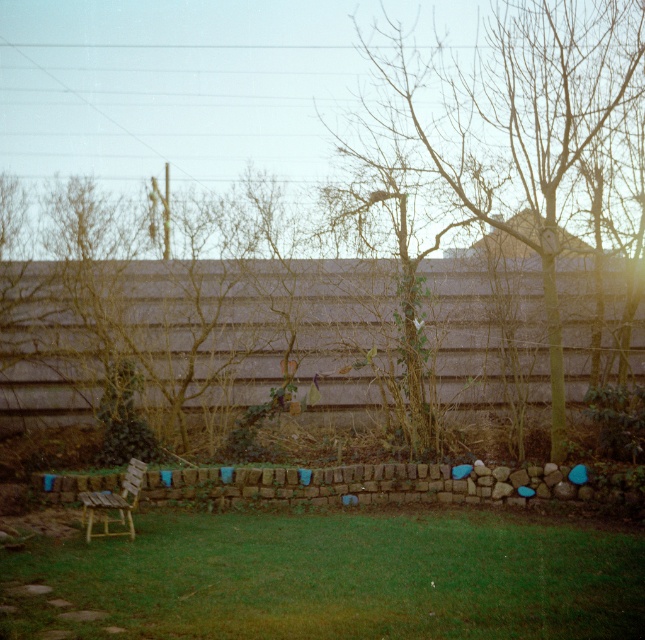
Does brown leafless tree at center come in front of wooden chair at lower left?

No, it is behind wooden chair at lower left.

Who is higher up, brown leafless tree at center or wooden chair at lower left?

Positioned higher is brown leafless tree at center.

The width and height of the screenshot is (645, 640). I want to click on brown leafless tree at center, so click(497, 131).

Where is `brown leafless tree at center`? brown leafless tree at center is located at coordinates (497, 131).

Does green grass at lower left lie in front of wooden chair at lower left?

Yes.

Who is higher up, green grass at lower left or wooden chair at lower left?

wooden chair at lower left is above.

Is point (250, 609) closer to camera compared to point (134, 467)?

That is True.

Find the location of a particular element. This screenshot has width=645, height=640. green grass at lower left is located at coordinates (330, 577).

Does green grass at lower left have a greater width compared to bare wood tree at center?

In fact, green grass at lower left might be narrower than bare wood tree at center.

How far apart are green grass at lower left and bare wood tree at center?

A distance of 9.91 meters exists between green grass at lower left and bare wood tree at center.

Between point (319, 621) and point (453, 152), which one is positioned behind?

Point (453, 152)

The image size is (645, 640). Identify the location of green grass at lower left. click(x=330, y=577).